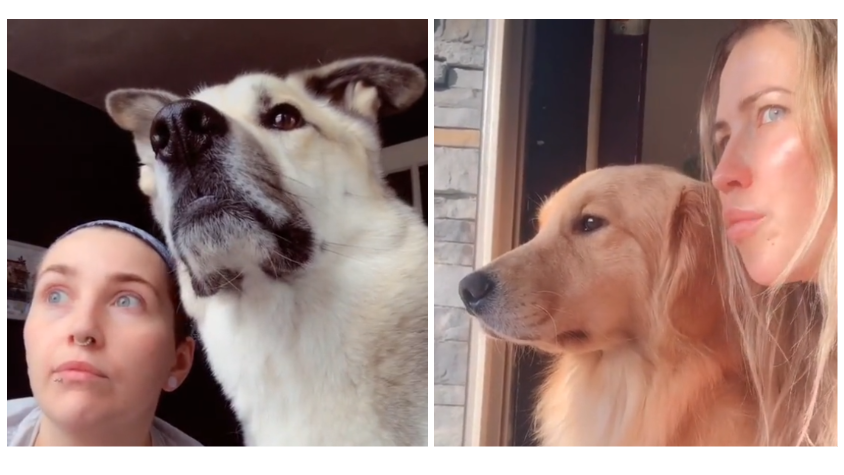
Locate an element on the screen. Image resolution: width=844 pixels, height=475 pixels. door is located at coordinates (414, 154).